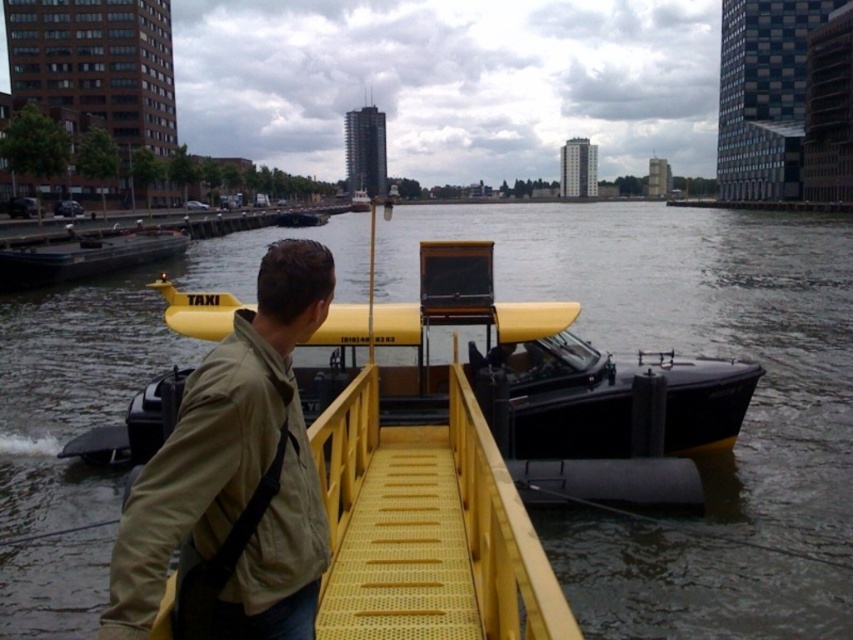
Which of these two, smooth water at center or yellow matte taxi boat at center, stands shorter?

yellow matte taxi boat at center is shorter.

Is smooth water at center positioned behind yellow matte taxi boat at center?

No.

The height and width of the screenshot is (640, 853). What are the coordinates of `smooth water at center` in the screenshot? It's located at coord(695,330).

Which of these two, smooth water at center or khaki fabric jacket at center, stands shorter?

khaki fabric jacket at center is shorter.

The height and width of the screenshot is (640, 853). What do you see at coordinates (695, 330) in the screenshot?
I see `smooth water at center` at bounding box center [695, 330].

Does point (762, 426) come farther from viewer compared to point (103, 621)?

Yes, point (762, 426) is behind point (103, 621).

Locate an element on the screen. smooth water at center is located at coordinates (695, 330).

Does khaki fabric jacket at center lie behind yellow matte taxi boat at center?

No, it is not.

In the scene shown: Between khaki fabric jacket at center and yellow matte taxi boat at center, which one appears on the right side from the viewer's perspective?

From the viewer's perspective, khaki fabric jacket at center appears more on the right side.

Measure the distance between point (265, 284) and camera.

Point (265, 284) is 3.03 meters from camera.

Find the location of `khaki fabric jacket at center`. khaki fabric jacket at center is located at coordinates (235, 474).